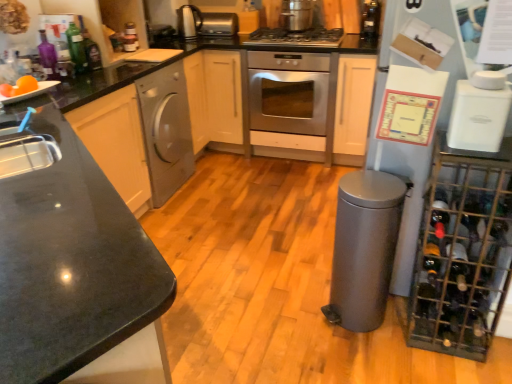
The width and height of the screenshot is (512, 384). In order to click on vacant area in front of satin silver trash can at lower right, arranged as the 1th appliance when ordered from the bottom in this screenshot , I will do `click(362, 358)`.